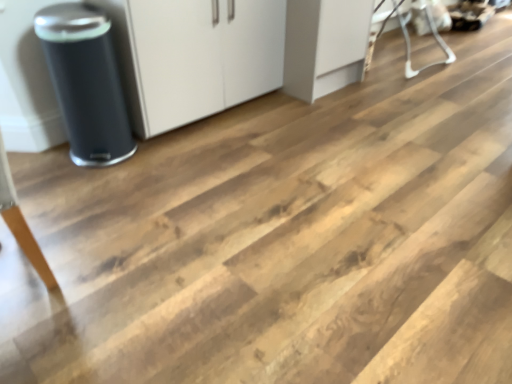
The width and height of the screenshot is (512, 384). What do you see at coordinates (203, 56) in the screenshot?
I see `white matte cabinet at center` at bounding box center [203, 56].

From the picture: What is the approximate height of white matte cabinet at center?

white matte cabinet at center is 70.94 centimeters tall.

Locate an element on the screen. The width and height of the screenshot is (512, 384). white plastic baby bouncer at upper right is located at coordinates (409, 39).

Would you say white matte cabinet at center is to the left or to the right of white plastic baby bouncer at upper right in the picture?

From the image, it's evident that white matte cabinet at center is to the left of white plastic baby bouncer at upper right.

In the scene shown: Can you tell me how much white matte cabinet at center and white plastic baby bouncer at upper right differ in facing direction?

The angle between the facing direction of white matte cabinet at center and the facing direction of white plastic baby bouncer at upper right is 0.000231 degrees.

Looking at this image, looking at their sizes, would you say white matte cabinet at center is wider or thinner than white plastic baby bouncer at upper right?

Clearly, white matte cabinet at center has less width compared to white plastic baby bouncer at upper right.

From a real-world perspective, is white matte cabinet at center located higher than white plastic baby bouncer at upper right?

Yes, from a real-world perspective, white matte cabinet at center is over white plastic baby bouncer at upper right

From the picture: From a real-world perspective, who is located higher, white plastic baby bouncer at upper right or matte black trash can at left?

matte black trash can at left, from a real-world perspective.

Is white plastic baby bouncer at upper right bigger or smaller than matte black trash can at left?

Considering their sizes, white plastic baby bouncer at upper right takes up more space than matte black trash can at left.

From the image's perspective, does white plastic baby bouncer at upper right appear lower than matte black trash can at left?

No, from the image's perspective, white plastic baby bouncer at upper right is not below matte black trash can at left.

Between matte black trash can at left and white matte cabinet at center, which one has smaller width?

Thinner between the two is matte black trash can at left.

Which is more to the left, matte black trash can at left or white matte cabinet at center?

Positioned to the left is matte black trash can at left.

From the image's perspective, who appears lower, matte black trash can at left or white matte cabinet at center?

matte black trash can at left.

Is matte black trash can at left inside the boundaries of white plastic baby bouncer at upper right, or outside?

matte black trash can at left is not inside white plastic baby bouncer at upper right, it's outside.

From the image's perspective, which is below, matte black trash can at left or white plastic baby bouncer at upper right?

matte black trash can at left.

Considering the relative sizes of matte black trash can at left and white plastic baby bouncer at upper right in the image provided, is matte black trash can at left bigger than white plastic baby bouncer at upper right?

No, matte black trash can at left is not bigger than white plastic baby bouncer at upper right.

Measure the distance from matte black trash can at left to white plastic baby bouncer at upper right.

matte black trash can at left is 2.15 meters from white plastic baby bouncer at upper right.

From a real-world perspective, is white matte cabinet at center physically below matte black trash can at left?

No, from a real-world perspective, white matte cabinet at center is not below matte black trash can at left.

Is point (198, 51) closer or farther from the camera than point (69, 127)?

Point (198, 51) appears to be farther away from the viewer than point (69, 127).

Considering the sizes of objects white matte cabinet at center and matte black trash can at left in the image provided, who is taller, white matte cabinet at center or matte black trash can at left?

With more height is white matte cabinet at center.

Does white plastic baby bouncer at upper right touch white matte cabinet at center?

No, white plastic baby bouncer at upper right is not touching white matte cabinet at center.

Considering the relative sizes of white plastic baby bouncer at upper right and white matte cabinet at center in the image provided, is white plastic baby bouncer at upper right thinner than white matte cabinet at center?

In fact, white plastic baby bouncer at upper right might be wider than white matte cabinet at center.

From a real-world perspective, is white plastic baby bouncer at upper right above or below white matte cabinet at center?

white plastic baby bouncer at upper right is below white matte cabinet at center.

The width and height of the screenshot is (512, 384). Identify the location of cabinetry that is on the left side of white plastic baby bouncer at upper right. (203, 56).

I want to click on furniture below the matte black trash can at left (from a real-world perspective), so click(409, 39).

Which object lies further to the anchor point matte black trash can at left, white plastic baby bouncer at upper right or white matte cabinet at center?

Based on the image, white plastic baby bouncer at upper right appears to be further to matte black trash can at left.

Looking at the image, which one is located further to white plastic baby bouncer at upper right, matte black trash can at left or white matte cabinet at center?

matte black trash can at left is positioned further to the anchor white plastic baby bouncer at upper right.

Considering their positions, is white plastic baby bouncer at upper right positioned further to white matte cabinet at center than matte black trash can at left?

Based on the image, white plastic baby bouncer at upper right appears to be further to white matte cabinet at center.

Which object lies nearer to the anchor point matte black trash can at left, white matte cabinet at center or white plastic baby bouncer at upper right?

The object closer to matte black trash can at left is white matte cabinet at center.

Looking at the image, which one is located closer to white matte cabinet at center, matte black trash can at left or white plastic baby bouncer at upper right?

Among the two, matte black trash can at left is located nearer to white matte cabinet at center.

Considering their positions, is white matte cabinet at center positioned further to white plastic baby bouncer at upper right than matte black trash can at left?

Among the two, matte black trash can at left is located further to white plastic baby bouncer at upper right.

The image size is (512, 384). Identify the location of cabinetry located between matte black trash can at left and white plastic baby bouncer at upper right in the left-right direction. (203, 56).